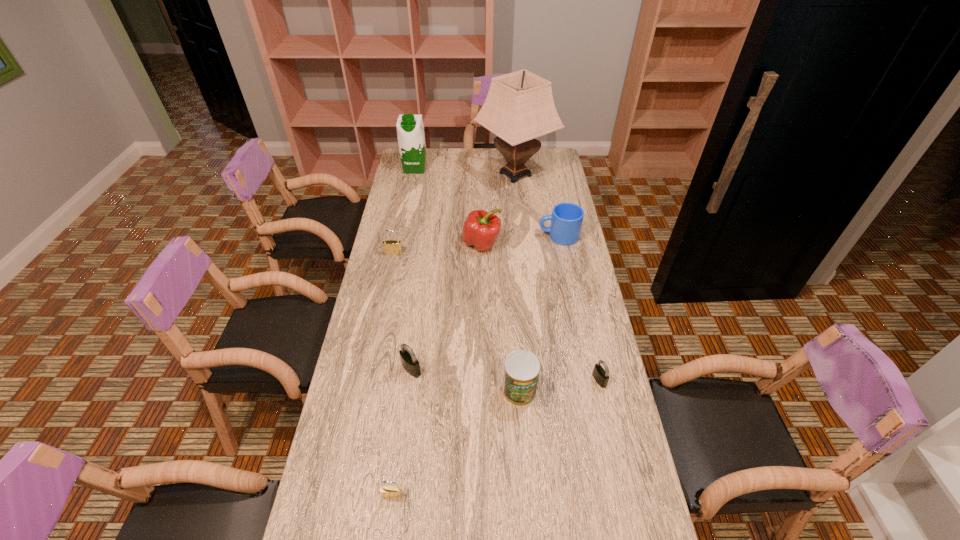
You are a GUI agent. You are given a task and a screenshot of the screen. Output one action in this format:
    pyautogui.click(x=<x>, y=<y>)
    Task: Click on the brown lampshade
    Image resolution: width=960 pixels, height=540 pixels.
    Given the screenshot: What is the action you would take?
    pyautogui.click(x=519, y=107)

Find the location of a particular element. the tallest object is located at coordinates (519, 107).

You are a GUI agent. You are given a task and a screenshot of the screen. Output one action in this format:
    pyautogui.click(x=<x>, y=<y>)
    Task: Click on the soya milk
    This screenshot has width=960, height=540.
    Given the screenshot: What is the action you would take?
    tap(410, 129)

Identify the location of green soya milk. The image size is (960, 540). (410, 129).

Find the location of a particular element. This screenshot has height=540, width=960. pink pepper is located at coordinates (481, 229).

Locate an element on the screen. This screenshot has height=540, width=960. can is located at coordinates (521, 369).

Identify the location of mug. pyautogui.click(x=566, y=219).

Find the location of a particular element. The image size is (960, 540). the farther brass padlock is located at coordinates (391, 247).

The image size is (960, 540). What are the coordinates of `the leftmost padlock` in the screenshot? It's located at (391, 247).

Where is `the left black padlock`? This screenshot has width=960, height=540. the left black padlock is located at coordinates (409, 361).